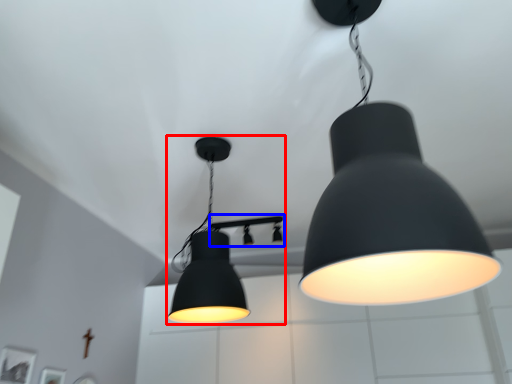
Question: Which object appears closest to the camera in this image, lamp (highlighted by a red box) or lamp (highlighted by a blue box)?

Choices:
 (A) lamp
 (B) lamp

Answer: (A)